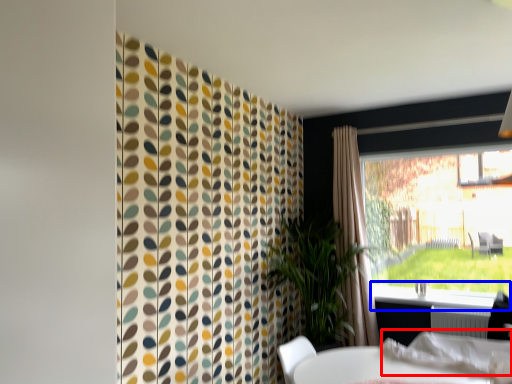
Question: Which object appears farthest to the camera in this image, linen (highlighted by a red box) or window sill (highlighted by a blue box)?

Choices:
 (A) linen
 (B) window sill

Answer: (B)